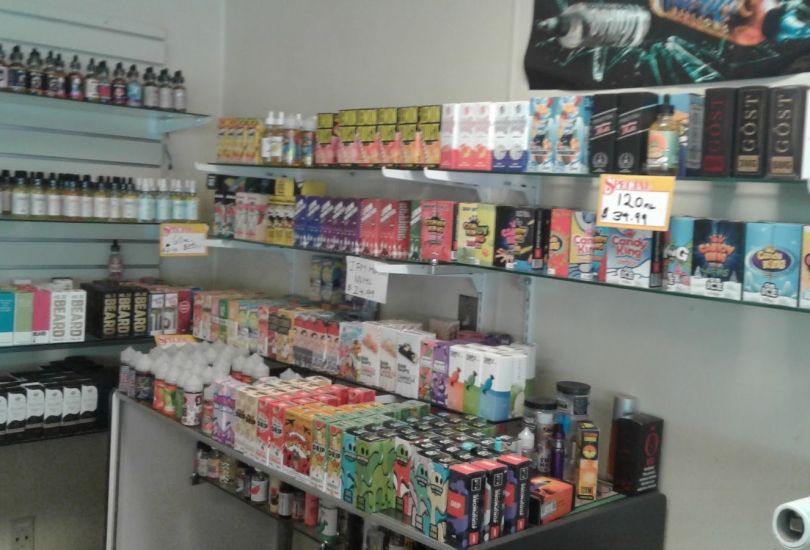
Identify the location of shelf. This screenshot has height=550, width=810. (620, 286), (525, 173), (124, 106), (112, 222), (94, 343), (60, 436), (216, 443), (263, 511), (355, 383), (318, 249).